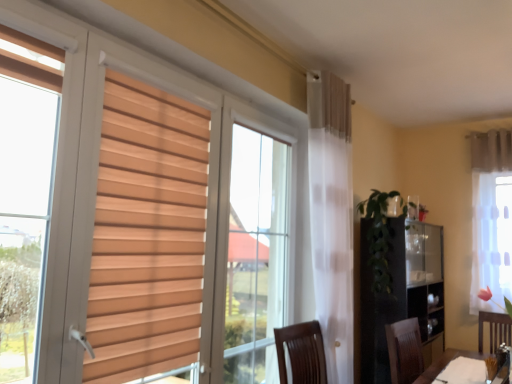
Question: From a real-world perspective, is white sheer curtain at upper right, the 2th curtain ordered from the bottom, beneath white sheer curtain at right, marked as the second curtain in a top-to-bottom arrangement?

Choices:
 (A) no
 (B) yes

Answer: (A)

Question: Is the depth of white sheer curtain at upper right, positioned as the first curtain in top-to-bottom order, less than that of white sheer curtain at right, acting as the 1th curtain starting from the bottom?

Choices:
 (A) no
 (B) yes

Answer: (A)

Question: Can you confirm if white sheer curtain at upper right, positioned as the first curtain in top-to-bottom order, is positioned to the left of white sheer curtain at right, marked as the second curtain in a top-to-bottom arrangement?

Choices:
 (A) no
 (B) yes

Answer: (A)

Question: Considering the relative sizes of white sheer curtain at upper right, positioned as the first curtain in top-to-bottom order, and white sheer curtain at right, acting as the 1th curtain starting from the bottom, in the image provided, is white sheer curtain at upper right, positioned as the first curtain in top-to-bottom order, thinner than white sheer curtain at right, acting as the 1th curtain starting from the bottom,?

Choices:
 (A) no
 (B) yes

Answer: (A)

Question: Does white sheer curtain at upper right, positioned as the first curtain in top-to-bottom order, have a greater width compared to white sheer curtain at right, marked as the second curtain in a top-to-bottom arrangement?

Choices:
 (A) yes
 (B) no

Answer: (A)

Question: In the image, is white sheer curtain at upper right, the 2th curtain ordered from the bottom, positioned in front of or behind white sheer curtain at right, acting as the 1th curtain starting from the bottom?

Choices:
 (A) front
 (B) behind

Answer: (B)

Question: Is white sheer curtain at upper right, positioned as the first curtain in top-to-bottom order, situated inside white sheer curtain at right, acting as the 1th curtain starting from the bottom, or outside?

Choices:
 (A) inside
 (B) outside

Answer: (B)

Question: Is white sheer curtain at upper right, positioned as the first curtain in top-to-bottom order, wider or thinner than white sheer curtain at right, acting as the 1th curtain starting from the bottom?

Choices:
 (A) wide
 (B) thin

Answer: (A)

Question: Based on their sizes in the image, would you say white sheer curtain at upper right, the 2th curtain ordered from the bottom, is bigger or smaller than white sheer curtain at right, acting as the 1th curtain starting from the bottom?

Choices:
 (A) big
 (B) small

Answer: (B)

Question: Based on their sizes in the image, would you say white sheer curtain at right, acting as the 1th curtain starting from the bottom, is bigger or smaller than white matte table at lower right?

Choices:
 (A) small
 (B) big

Answer: (B)

Question: Relative to white matte table at lower right, is white sheer curtain at right, acting as the 1th curtain starting from the bottom, in front or behind?

Choices:
 (A) behind
 (B) front

Answer: (A)

Question: Would you say white sheer curtain at right, acting as the 1th curtain starting from the bottom, is inside or outside white matte table at lower right?

Choices:
 (A) outside
 (B) inside

Answer: (A)

Question: Would you say white sheer curtain at right, marked as the second curtain in a top-to-bottom arrangement, is to the left or to the right of white matte table at lower right in the picture?

Choices:
 (A) right
 (B) left

Answer: (A)

Question: From a real-world perspective, is green leafy plant at center-right positioned above or below white sheer curtain at right, marked as the second curtain in a top-to-bottom arrangement?

Choices:
 (A) above
 (B) below

Answer: (B)

Question: Does point (387, 259) appear closer or farther from the camera than point (476, 302)?

Choices:
 (A) farther
 (B) closer

Answer: (B)